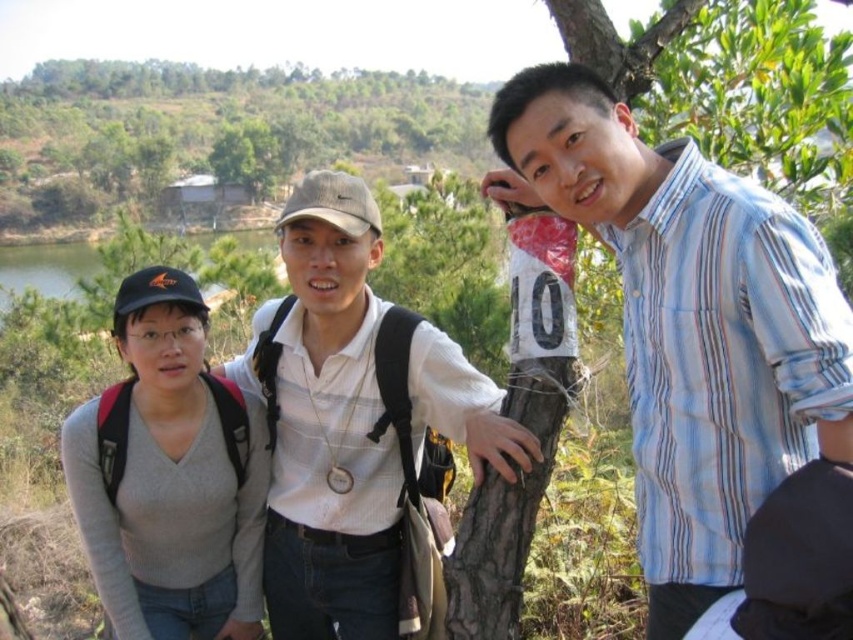
Question: Which of the following is the closest to the observer?

Choices:
 (A) gray matte sweater at left
 (B) blue striped shirt at right

Answer: (B)

Question: Which point is closer to the camera taking this photo?

Choices:
 (A) (817, 237)
 (B) (225, 512)

Answer: (A)

Question: Does blue striped shirt at right appear under gray sweater at left?

Choices:
 (A) yes
 (B) no

Answer: (B)

Question: Where is gray sweater at left located in relation to gray matte sweater at left in the image?

Choices:
 (A) right
 (B) left

Answer: (A)

Question: Is blue striped shirt at right to the right of gray matte sweater at left from the viewer's perspective?

Choices:
 (A) yes
 (B) no

Answer: (A)

Question: Which of the following is the farthest from the observer?

Choices:
 (A) blue striped shirt at right
 (B) gray sweater at left

Answer: (B)